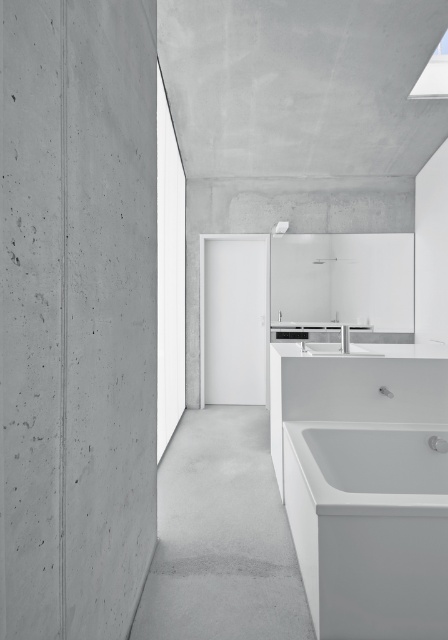
Is white glossy bathtub at lower right thinner than gray concrete floor at center?

Incorrect, white glossy bathtub at lower right's width is not less than gray concrete floor at center's.

Is point (327, 552) less distant than point (164, 524)?

Yes.

Where is `white glossy bathtub at lower right`? The height and width of the screenshot is (640, 448). white glossy bathtub at lower right is located at coordinates (370, 525).

How distant is white glossy bathtub at lower right from white glossy sink at center?

white glossy bathtub at lower right is 34.79 inches away from white glossy sink at center.

Consider the image. Does white glossy bathtub at lower right have a larger size compared to white glossy sink at center?

Yes.

Locate an element on the screen. white glossy bathtub at lower right is located at coordinates (370, 525).

Between point (219, 540) and point (331, 349), which one is positioned behind?

The point (331, 349) is more distant.

In order to click on gray concrete floor at center in this screenshot , I will do `click(222, 538)`.

The height and width of the screenshot is (640, 448). Identify the location of gray concrete floor at center. (222, 538).